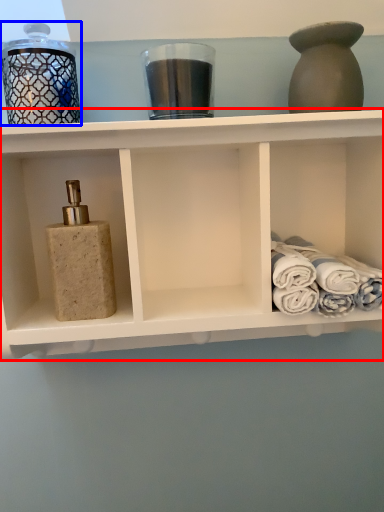
Question: Which point is closer to the camera, shelf (highlighted by a red box) or glass jar (highlighted by a blue box)?

Choices:
 (A) shelf
 (B) glass jar

Answer: (A)